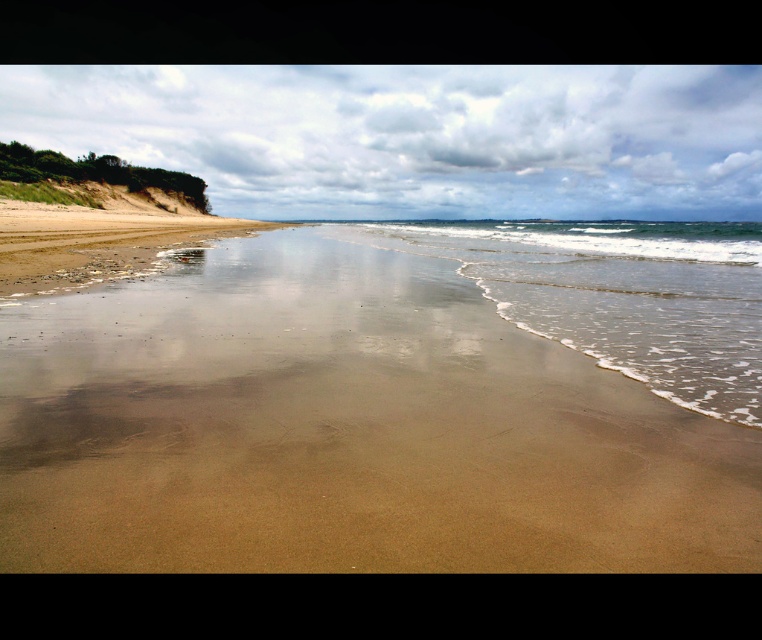
Between smooth sand at center and clear water at lower center, which one has less height?

smooth sand at center

Can you confirm if smooth sand at center is wider than clear water at lower center?

In fact, smooth sand at center might be narrower than clear water at lower center.

Between point (303, 406) and point (754, 400), which one is positioned in front?

Point (303, 406) is in front.

The image size is (762, 640). Find the location of `smooth sand at center`. smooth sand at center is located at coordinates (343, 429).

Is point (475, 246) positioned after point (231, 221)?

That is False.

Measure the distance between clear water at lower center and camera.

A distance of 13.95 feet exists between clear water at lower center and camera.

Identify the location of clear water at lower center. This screenshot has width=762, height=640. (618, 294).

Does smooth sand at center appear under brown sandy beach at left?

Correct, smooth sand at center is located below brown sandy beach at left.

Is smooth sand at center closer to the viewer compared to brown sandy beach at left?

Yes.

I want to click on smooth sand at center, so click(x=343, y=429).